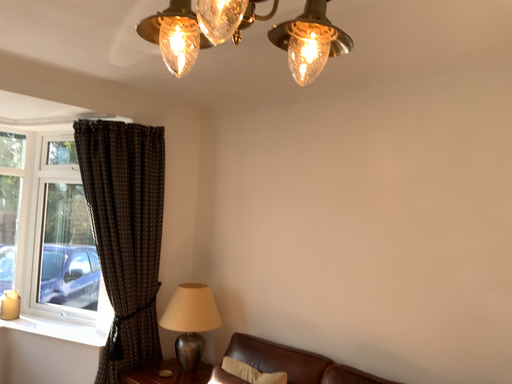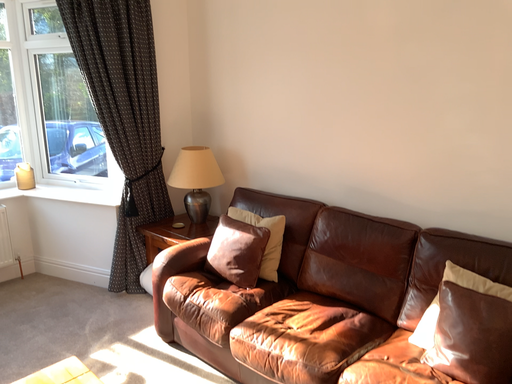
Question: Which way did the camera rotate in the video?

Choices:
 (A) rotated downward
 (B) rotated upward

Answer: (A)